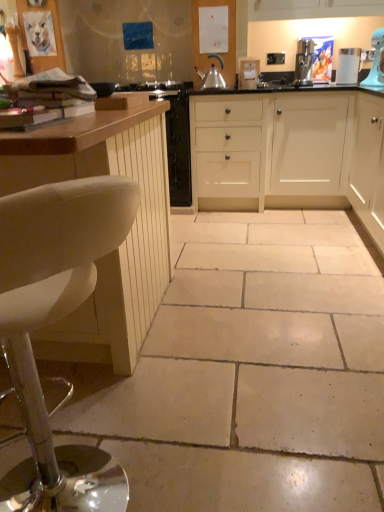
Question: From the image's perspective, is white leather stool at left over beige tile floor at center?

Choices:
 (A) yes
 (B) no

Answer: (B)

Question: Considering the relative sizes of white leather stool at left and beige tile floor at center in the image provided, is white leather stool at left thinner than beige tile floor at center?

Choices:
 (A) no
 (B) yes

Answer: (B)

Question: Does white leather stool at left come behind beige tile floor at center?

Choices:
 (A) yes
 (B) no

Answer: (B)

Question: Is white leather stool at left positioned in front of beige tile floor at center?

Choices:
 (A) no
 (B) yes

Answer: (B)

Question: Does white leather stool at left have a larger size compared to beige tile floor at center?

Choices:
 (A) no
 (B) yes

Answer: (A)

Question: Based on their positions, is white wood cabinet at left, the 3th cabinetry when ordered from right to left, located to the left or right of white matte cabinet at center, the second cabinetry when ordered from right to left?

Choices:
 (A) left
 (B) right

Answer: (A)

Question: Is white wood cabinet at left, marked as the first cabinetry in a left-to-right arrangement, inside the boundaries of white matte cabinet at center, the second cabinetry when ordered from right to left, or outside?

Choices:
 (A) outside
 (B) inside

Answer: (A)

Question: In terms of size, does white wood cabinet at left, the 3th cabinetry when ordered from right to left, appear bigger or smaller than white matte cabinet at center, the second cabinetry when ordered from right to left?

Choices:
 (A) big
 (B) small

Answer: (B)

Question: In terms of width, does white wood cabinet at left, marked as the first cabinetry in a left-to-right arrangement, look wider or thinner when compared to white matte cabinet at center, the second cabinetry when ordered from right to left?

Choices:
 (A) thin
 (B) wide

Answer: (B)

Question: Considering the positions of white glossy coffee maker at upper right and white leather stool at left in the image, is white glossy coffee maker at upper right taller or shorter than white leather stool at left?

Choices:
 (A) tall
 (B) short

Answer: (B)

Question: Is point (349, 60) positioned closer to the camera than point (49, 274)?

Choices:
 (A) closer
 (B) farther

Answer: (B)

Question: Would you say white glossy coffee maker at upper right is to the left or to the right of white leather stool at left in the picture?

Choices:
 (A) right
 (B) left

Answer: (A)

Question: From a real-world perspective, is white glossy coffee maker at upper right positioned above or below white leather stool at left?

Choices:
 (A) below
 (B) above

Answer: (B)

Question: From a real-world perspective, is white matte cabinet at center, marked as the 2th cabinetry in a left-to-right arrangement, physically located above or below white leather stool at left?

Choices:
 (A) above
 (B) below

Answer: (A)

Question: Relative to white leather stool at left, is white matte cabinet at center, marked as the 2th cabinetry in a left-to-right arrangement, in front or behind?

Choices:
 (A) front
 (B) behind

Answer: (B)